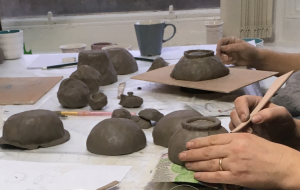
This screenshot has width=300, height=190. I want to click on window, so click(79, 8).